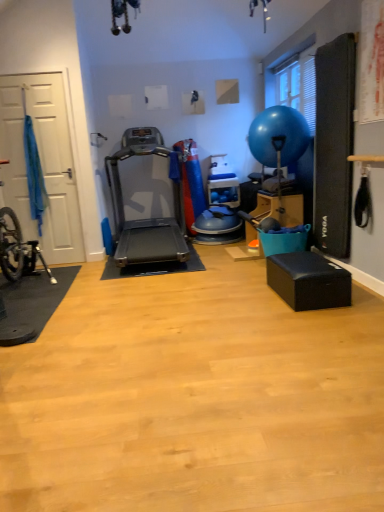
The height and width of the screenshot is (512, 384). Find the location of `blue rubber balloon at upper right`. blue rubber balloon at upper right is located at coordinates (278, 135).

Locate an element on the screen. This screenshot has height=512, width=384. blue rubber balloon at upper right is located at coordinates (278, 135).

Between point (178, 242) and point (303, 117), which one is positioned behind?

Point (178, 242)

Considering the positions of objects silver metallic treadmill at center and blue rubber balloon at upper right in the image provided, who is in front, silver metallic treadmill at center or blue rubber balloon at upper right?

silver metallic treadmill at center is in front.

Considering the relative sizes of silver metallic treadmill at center and blue rubber balloon at upper right in the image provided, is silver metallic treadmill at center smaller than blue rubber balloon at upper right?

No.

From their relative heights in the image, would you say silver metallic treadmill at center is taller or shorter than blue rubber balloon at upper right?

Clearly, silver metallic treadmill at center is taller compared to blue rubber balloon at upper right.

You are a GUI agent. You are given a task and a screenshot of the screen. Output one action in this format:
    pyautogui.click(x=<x>, y=<y>)
    Task: Click on the garage door positioned vertically above the silver metallic treadmill at center (from a real-world perspective)
    
    Given the screenshot: What is the action you would take?
    pyautogui.click(x=42, y=163)

Considering the positions of objects silver metallic treadmill at center and white matte door at left in the image provided, who is more to the left, silver metallic treadmill at center or white matte door at left?

Positioned to the left is white matte door at left.

How far apart are silver metallic treadmill at center and white matte door at left?

silver metallic treadmill at center is 86.69 centimeters from white matte door at left.

Is silver metallic treadmill at center positioned with its back to white matte door at left?

No, white matte door at left is not at the back of silver metallic treadmill at center.

Is blue rubber balloon at upper right inside the boundaries of white matte door at left, or outside?

blue rubber balloon at upper right is not enclosed by white matte door at left.

Which is farther, [281,108] or [66,135]?

Point [66,135]

Locate an element on the screen. garage door behind the blue rubber balloon at upper right is located at coordinates (42, 163).

Between blue rubber balloon at upper right and white matte door at left, which one has larger size?

Bigger between the two is blue rubber balloon at upper right.

Can you confirm if white matte door at left is taller than silver metallic treadmill at center?

Correct, white matte door at left is much taller as silver metallic treadmill at center.

Find the location of `garage door above the silver metallic treadmill at center (from a real-world perspective)`. garage door above the silver metallic treadmill at center (from a real-world perspective) is located at coordinates (42, 163).

Consider the image. Does white matte door at left lie in front of silver metallic treadmill at center?

No.

Based on the photo, from a real-world perspective, is white matte door at left positioned under silver metallic treadmill at center based on gravity?

Incorrect, from a real-world perspective, white matte door at left is higher than silver metallic treadmill at center.

Between white matte door at left and blue rubber balloon at upper right, which one has larger width?

blue rubber balloon at upper right.

Considering the positions of objects white matte door at left and blue rubber balloon at upper right in the image provided, who is more to the left, white matte door at left or blue rubber balloon at upper right?

white matte door at left.

Identify the location of garage door that is behind the blue rubber balloon at upper right. This screenshot has height=512, width=384. (42, 163).

Between point (42, 135) and point (298, 148), which one is positioned in front?

The point (298, 148) is more forward.

Who is more distant, blue rubber balloon at upper right or silver metallic treadmill at center?

blue rubber balloon at upper right is more distant.

Is blue rubber balloon at upper right directly adjacent to silver metallic treadmill at center?

They are not placed beside each other.

In order to click on treadmill below the blue rubber balloon at upper right (from a real-world perspective) in this screenshot , I will do [145, 219].

The width and height of the screenshot is (384, 512). Find the location of `treadmill that is on the right side of white matte door at left`. treadmill that is on the right side of white matte door at left is located at coordinates (145, 219).

Considering their positions, is blue rubber balloon at upper right positioned closer to white matte door at left than silver metallic treadmill at center?

The object closer to white matte door at left is silver metallic treadmill at center.

When comparing their distances from silver metallic treadmill at center, does blue rubber balloon at upper right or white matte door at left seem closer?

Among the two, white matte door at left is located nearer to silver metallic treadmill at center.

Which object lies further to the anchor point silver metallic treadmill at center, white matte door at left or blue rubber balloon at upper right?

blue rubber balloon at upper right is positioned further to the anchor silver metallic treadmill at center.

Based on their spatial positions, is silver metallic treadmill at center or white matte door at left further from blue rubber balloon at upper right?

white matte door at left is further to blue rubber balloon at upper right.

Considering their positions, is silver metallic treadmill at center positioned further to white matte door at left than blue rubber balloon at upper right?

Based on the image, blue rubber balloon at upper right appears to be further to white matte door at left.

Based on the photo, estimate the real-world distances between objects in this image. Which object is further from blue rubber balloon at upper right, white matte door at left or silver metallic treadmill at center?

The object further to blue rubber balloon at upper right is white matte door at left.

Find the location of a particular element. This screenshot has width=384, height=512. treadmill situated between white matte door at left and blue rubber balloon at upper right from left to right is located at coordinates (145, 219).